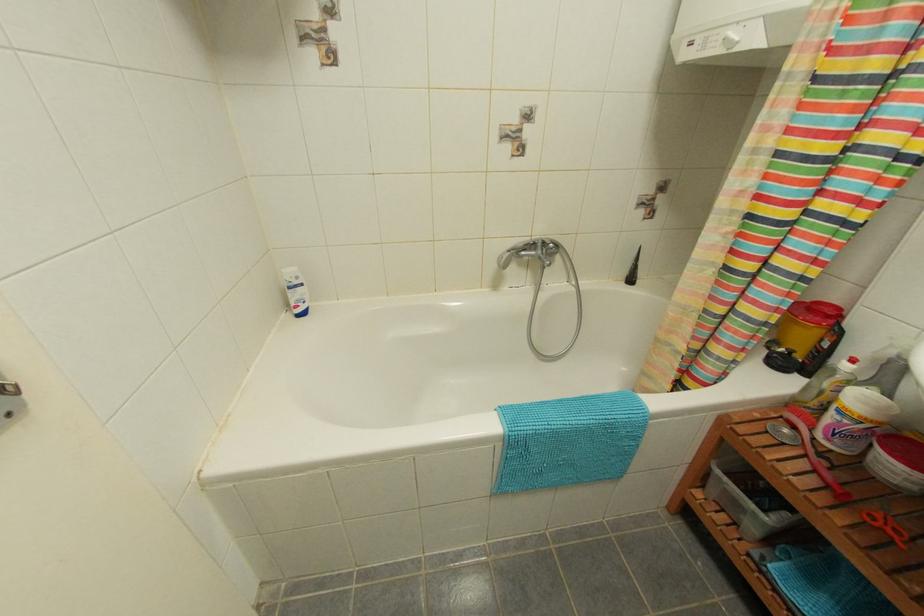
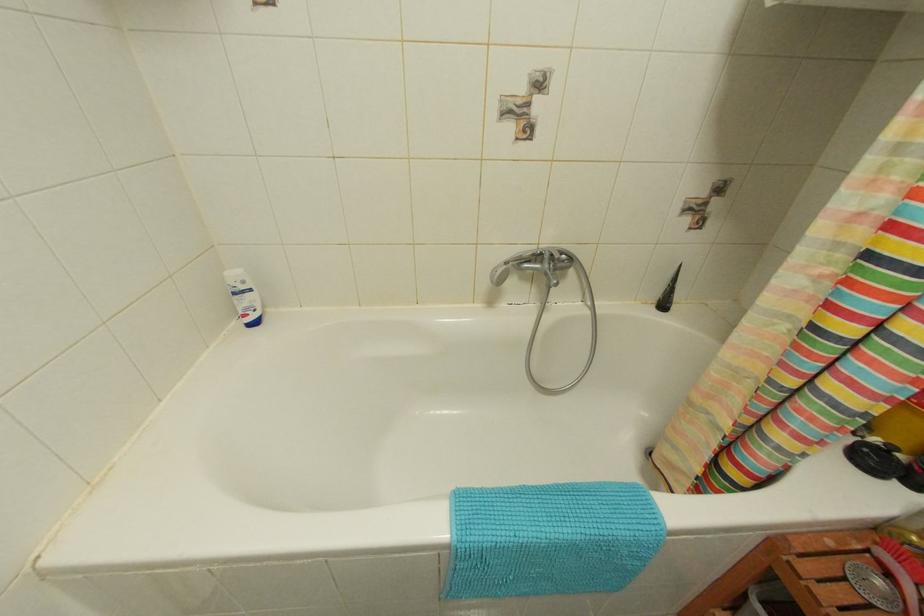
Question: The camera is either moving clockwise (left) or counter-clockwise (right) around the object. The first image is from the beginning of the video and the second image is from the end. Is the camera moving left or right when shooting the video?

Choices:
 (A) Left
 (B) Right

Answer: (B)